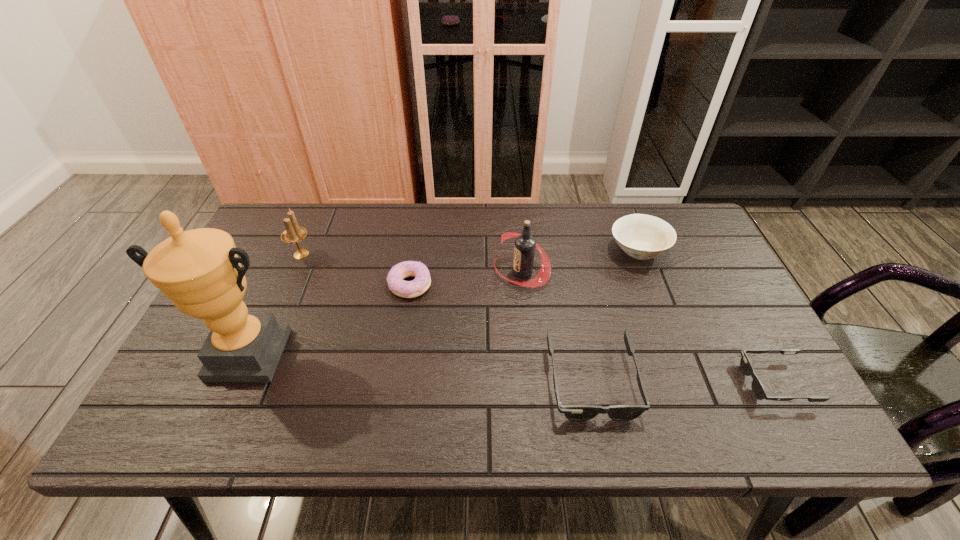
Identify the location of doughnut. This screenshot has height=540, width=960. (406, 289).

This screenshot has height=540, width=960. What are the coordinates of `free space located 0.360m on the temples of the rightmost object` in the screenshot? It's located at (587, 382).

The height and width of the screenshot is (540, 960). What are the coordinates of `vacant area located 0.270m on the temples of the rightmost object` in the screenshot? It's located at (627, 382).

The height and width of the screenshot is (540, 960). I want to click on free space located on the temples of the rightmost object, so pyautogui.click(x=692, y=382).

At what (x,y) coordinates should I click in order to perform the action: click on free space located on the label of the root beer. Please return your answer as a coordinate pair (x, y). This screenshot has height=540, width=960. Looking at the image, I should click on (477, 272).

Identify the location of blank space located 0.070m on the label of the root beer. (469, 272).

Where is `vacant point located on the label of the root beer`? The width and height of the screenshot is (960, 540). vacant point located on the label of the root beer is located at coordinates (467, 272).

I want to click on vacant space positioned 0.190m on the back of the candle holder, so click(x=321, y=209).

This screenshot has width=960, height=540. Find the location of `free space located on the right of the second object from right to left`. free space located on the right of the second object from right to left is located at coordinates (688, 250).

This screenshot has width=960, height=540. What are the coordinates of `vacant space located on the left of the third object from left to right` in the screenshot? It's located at (301, 285).